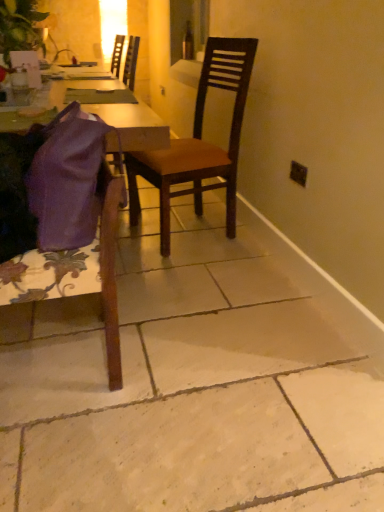
The height and width of the screenshot is (512, 384). In order to click on free location in front of purple fabric bag at lower left, the 2th chair from the back in this screenshot , I will do `click(76, 449)`.